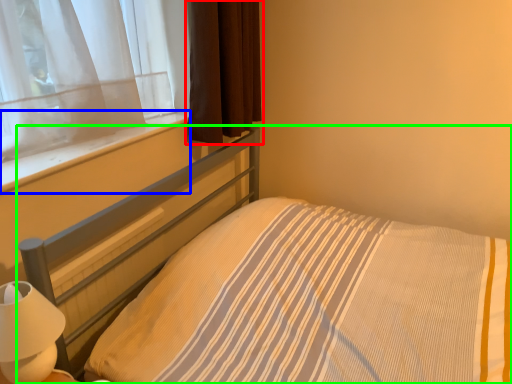
Question: Considering the real-world distances, which object is closest to curtain (highlighted by a red box)? window sill (highlighted by a blue box) or bed (highlighted by a green box).

Choices:
 (A) window sill
 (B) bed

Answer: (A)